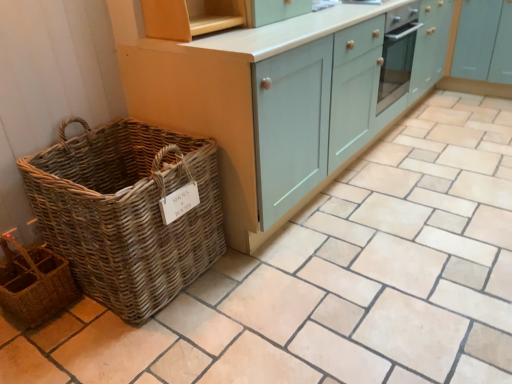
The width and height of the screenshot is (512, 384). Describe the element at coordinates (286, 99) in the screenshot. I see `matte teal cabinet at center, which is counted as the first cabinetry, starting from the left` at that location.

Measure the distance between matte teal cabinet at center, which is counted as the first cabinetry, starting from the left, and camera.

matte teal cabinet at center, which is counted as the first cabinetry, starting from the left, and camera are 1.50 meters apart.

Measure the distance between point (x=153, y=232) and camera.

A distance of 1.52 meters exists between point (x=153, y=232) and camera.

You are a GUI agent. You are given a task and a screenshot of the screen. Output one action in this format:
    pyautogui.click(x=<x>, y=<y>)
    Task: Click on the matte teal cabinet at center, which is the second cabinetry from right to left
    
    Given the screenshot: What is the action you would take?
    pyautogui.click(x=286, y=99)

Does point (1, 302) appear closer or farther from the camera than point (229, 13)?

Point (1, 302) is positioned closer to the camera compared to point (229, 13).

From the image's perspective, which one is positioned lower, rustic wicker basket at lower left or wooden shelf at upper center?

rustic wicker basket at lower left is shown below in the image.

At what (x,y) coordinates should I click in order to perform the action: click on basket lying on the left of wooden shelf at upper center. Please return your answer as a coordinate pair (x, y). The image size is (512, 384). Looking at the image, I should click on (34, 284).

Can you confirm if rustic wicker basket at lower left is bigger than wooden shelf at upper center?

Yes, rustic wicker basket at lower left is bigger than wooden shelf at upper center.

In the image, is light blue wood cabinet at upper right, which is counted as the first cabinetry, starting from the right, positioned in front of or behind wooden shelf at upper center?

light blue wood cabinet at upper right, which is counted as the first cabinetry, starting from the right, is behind wooden shelf at upper center.

From the picture: Is light blue wood cabinet at upper right, which ranks as the second cabinetry in left-to-right order, looking in the opposite direction of wooden shelf at upper center?

light blue wood cabinet at upper right, which ranks as the second cabinetry in left-to-right order, does not have its back to wooden shelf at upper center.

How distant is light blue wood cabinet at upper right, which is counted as the first cabinetry, starting from the right, from wooden shelf at upper center?

light blue wood cabinet at upper right, which is counted as the first cabinetry, starting from the right, is 2.42 meters from wooden shelf at upper center.

From the picture: Between light blue wood cabinet at upper right, which ranks as the second cabinetry in left-to-right order, and wooden shelf at upper center, which one has more height?

Standing taller between the two is light blue wood cabinet at upper right, which ranks as the second cabinetry in left-to-right order.

Considering the relative positions of woven brown basket at left and light blue wood cabinet at upper right, which ranks as the second cabinetry in left-to-right order, in the image provided, is woven brown basket at left in front of light blue wood cabinet at upper right, which ranks as the second cabinetry in left-to-right order,?

Yes, the depth of woven brown basket at left is less than that of light blue wood cabinet at upper right, which ranks as the second cabinetry in left-to-right order.

Is point (34, 186) positioned before point (490, 94)?

Yes, it is.

Considering the sizes of objects woven brown basket at left and light blue wood cabinet at upper right, which ranks as the second cabinetry in left-to-right order, in the image provided, who is shorter, woven brown basket at left or light blue wood cabinet at upper right, which ranks as the second cabinetry in left-to-right order,?

Standing shorter between the two is woven brown basket at left.

Is woven brown basket at left touching light blue wood cabinet at upper right, which ranks as the second cabinetry in left-to-right order?

No.

Considering the positions of points (453, 37) and (31, 327), is point (453, 37) closer to camera compared to point (31, 327)?

No.

From the image's perspective, is light blue wood cabinet at upper right, which ranks as the second cabinetry in left-to-right order, above or below rustic wicker basket at lower left?

From the image's perspective, light blue wood cabinet at upper right, which ranks as the second cabinetry in left-to-right order, appears above rustic wicker basket at lower left.

Is light blue wood cabinet at upper right, which ranks as the second cabinetry in left-to-right order, next to rustic wicker basket at lower left and touching it?

No, light blue wood cabinet at upper right, which ranks as the second cabinetry in left-to-right order, is not making contact with rustic wicker basket at lower left.

From the image's perspective, is matte teal cabinet at center, which is the second cabinetry from right to left, positioned above or below rustic wicker basket at lower left?

Clearly, from the image's perspective, matte teal cabinet at center, which is the second cabinetry from right to left, is above rustic wicker basket at lower left.

From a real-world perspective, which object rests below the other?

rustic wicker basket at lower left.

In the scene shown: Could you tell me if matte teal cabinet at center, which is the second cabinetry from right to left, is facing rustic wicker basket at lower left?

No, matte teal cabinet at center, which is the second cabinetry from right to left, is not aimed at rustic wicker basket at lower left.

Which of these two, matte teal cabinet at center, which is the second cabinetry from right to left, or rustic wicker basket at lower left, is wider?

With larger width is matte teal cabinet at center, which is the second cabinetry from right to left.

Does point (198, 248) come in front of point (162, 13)?

No, it is behind (162, 13).

In the image, is woven brown basket at left on the left side or the right side of wooden shelf at upper center?

woven brown basket at left is positioned on wooden shelf at upper center's left side.

From the image's perspective, is woven brown basket at left located above or below wooden shelf at upper center?

woven brown basket at left is below wooden shelf at upper center.

In the scene shown: Which of these two, woven brown basket at left or wooden shelf at upper center, stands taller?

woven brown basket at left.

Does wooden shelf at upper center turn towards light blue wood cabinet at upper right, which ranks as the second cabinetry in left-to-right order?

No, wooden shelf at upper center is not aimed at light blue wood cabinet at upper right, which ranks as the second cabinetry in left-to-right order.

How distant is wooden shelf at upper center from light blue wood cabinet at upper right, which ranks as the second cabinetry in left-to-right order?

The distance of wooden shelf at upper center from light blue wood cabinet at upper right, which ranks as the second cabinetry in left-to-right order, is 2.42 meters.

Can you tell me how much wooden shelf at upper center and light blue wood cabinet at upper right, which is counted as the first cabinetry, starting from the right, differ in facing direction?

They differ by 86.4 degrees in their facing directions.

Can you confirm if wooden shelf at upper center is taller than light blue wood cabinet at upper right, which is counted as the first cabinetry, starting from the right?

No.

I want to click on shelf that is above the rustic wicker basket at lower left (from the image's perspective), so click(x=190, y=17).

Find the location of a particular element. The image size is (512, 384). cabinetry behind the wooden shelf at upper center is located at coordinates (463, 78).

When comparing their distances from rustic wicker basket at lower left, does wooden shelf at upper center or light blue wood cabinet at upper right, which ranks as the second cabinetry in left-to-right order, seem closer?

Based on the image, wooden shelf at upper center appears to be nearer to rustic wicker basket at lower left.

Considering their positions, is matte teal cabinet at center, which is the second cabinetry from right to left, positioned closer to rustic wicker basket at lower left than woven brown basket at left?

Based on the image, woven brown basket at left appears to be nearer to rustic wicker basket at lower left.

Estimate the real-world distances between objects in this image. Which object is further from matte teal cabinet at center, which is the second cabinetry from right to left, woven brown basket at left or wooden shelf at upper center?

The object further to matte teal cabinet at center, which is the second cabinetry from right to left, is woven brown basket at left.

Estimate the real-world distances between objects in this image. Which object is further from matte teal cabinet at center, which is the second cabinetry from right to left, wooden shelf at upper center or rustic wicker basket at lower left?

rustic wicker basket at lower left is positioned further to the anchor matte teal cabinet at center, which is the second cabinetry from right to left.

Looking at the image, which one is located closer to woven brown basket at left, light blue wood cabinet at upper right, which is counted as the first cabinetry, starting from the right, or wooden shelf at upper center?

wooden shelf at upper center is closer to woven brown basket at left.

Consider the image. Looking at the image, which one is located closer to wooden shelf at upper center, light blue wood cabinet at upper right, which is counted as the first cabinetry, starting from the right, or rustic wicker basket at lower left?

The object closer to wooden shelf at upper center is rustic wicker basket at lower left.

Looking at the image, which one is located closer to rustic wicker basket at lower left, woven brown basket at left or matte teal cabinet at center, which is counted as the first cabinetry, starting from the left?

Based on the image, woven brown basket at left appears to be nearer to rustic wicker basket at lower left.

Looking at the image, which one is located closer to matte teal cabinet at center, which is the second cabinetry from right to left, rustic wicker basket at lower left or light blue wood cabinet at upper right, which ranks as the second cabinetry in left-to-right order?

Based on the image, rustic wicker basket at lower left appears to be nearer to matte teal cabinet at center, which is the second cabinetry from right to left.

Locate an element on the screen. The image size is (512, 384). picnic basket between rustic wicker basket at lower left and matte teal cabinet at center, which is the second cabinetry from right to left is located at coordinates (127, 212).

The height and width of the screenshot is (384, 512). Find the location of `shelf between woven brown basket at left and matte teal cabinet at center, which is counted as the first cabinetry, starting from the left, from left to right`. shelf between woven brown basket at left and matte teal cabinet at center, which is counted as the first cabinetry, starting from the left, from left to right is located at coordinates (190, 17).

You are a GUI agent. You are given a task and a screenshot of the screen. Output one action in this format:
    pyautogui.click(x=<x>, y=<y>)
    Task: Click on the shelf between rustic wicker basket at lower left and light blue wood cabinet at upper right, which ranks as the second cabinetry in left-to-right order
    The height and width of the screenshot is (384, 512).
    Given the screenshot: What is the action you would take?
    pyautogui.click(x=190, y=17)

Find the location of a particular element. shelf between rustic wicker basket at lower left and matte teal cabinet at center, which is counted as the first cabinetry, starting from the left, in the horizontal direction is located at coordinates [x=190, y=17].